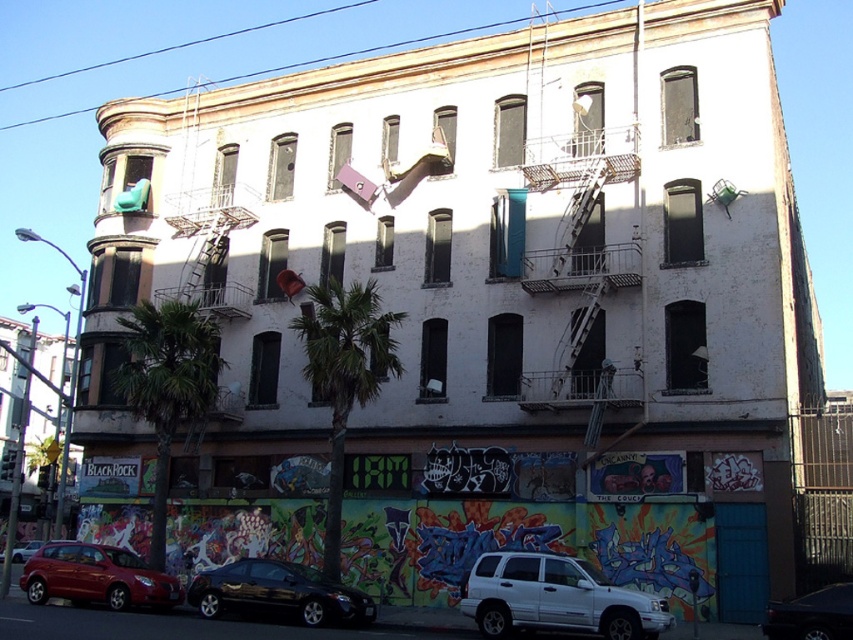
Question: Among these objects, which one is nearest to the camera?

Choices:
 (A) white matte suv at lower center
 (B) shiny red sedan at lower left
 (C) shiny black car at lower center

Answer: (A)

Question: Observing the image, what is the correct spatial positioning of white matte suv at lower center in reference to shiny black truck at lower right?

Choices:
 (A) above
 (B) below

Answer: (B)

Question: Which point appears farthest from the camera in this image?

Choices:
 (A) (830, 636)
 (B) (471, 592)
 (C) (105, 547)
 (D) (364, 600)

Answer: (C)

Question: Does shiny black car at lower center come in front of shiny red sedan at lower left?

Choices:
 (A) yes
 (B) no

Answer: (A)

Question: Where is white matte suv at lower center located in relation to matte red suv at lower left in the image?

Choices:
 (A) left
 (B) right

Answer: (B)

Question: Which object appears closest to the camera in this image?

Choices:
 (A) white matte suv at lower center
 (B) shiny red sedan at lower left

Answer: (A)